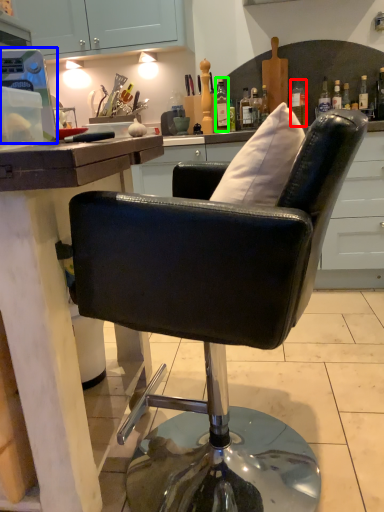
Question: Which object is positioned closest to bottle (highlighted by a red box)? Select from appliance (highlighted by a blue box) and bottle (highlighted by a green box).

Choices:
 (A) appliance
 (B) bottle

Answer: (B)